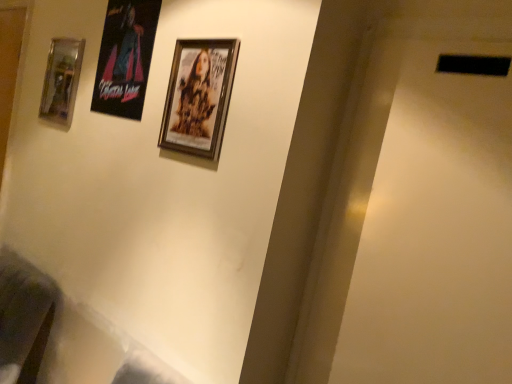
How much space does metallic glass picture frame at left, acting as the first picture frame starting from the left, occupy vertically?

metallic glass picture frame at left, acting as the first picture frame starting from the left, is 36.32 centimeters tall.

At what (x,y) coordinates should I click in order to perform the action: click on metallic glass picture frame at left, placed as the first picture frame when sorted from back to front. Please return your answer as a coordinate pair (x, y). The height and width of the screenshot is (384, 512). Looking at the image, I should click on (61, 81).

Describe the element at coordinates (61, 81) in the screenshot. This screenshot has width=512, height=384. I see `metallic glass picture frame at left, the second picture frame from the front` at that location.

You are a GUI agent. You are given a task and a screenshot of the screen. Output one action in this format:
    pyautogui.click(x=<x>, y=<y>)
    Task: Click on the wooden framed poster at center, arranged as the second picture frame when viewed from the left
    The height and width of the screenshot is (384, 512).
    Given the screenshot: What is the action you would take?
    pyautogui.click(x=199, y=96)

The height and width of the screenshot is (384, 512). Describe the element at coordinates (199, 96) in the screenshot. I see `wooden framed poster at center, arranged as the second picture frame when viewed from the left` at that location.

Identify the location of metallic glass picture frame at left, which appears as the 2th picture frame when viewed from the right. This screenshot has width=512, height=384. (61, 81).

Would you say metallic glass picture frame at left, which appears as the 2th picture frame when viewed from the right, is to the left or to the right of wooden framed poster at center, the second picture frame in the back-to-front sequence, in the picture?

metallic glass picture frame at left, which appears as the 2th picture frame when viewed from the right, is to the left of wooden framed poster at center, the second picture frame in the back-to-front sequence.

Based on the photo, in the image, is metallic glass picture frame at left, which appears as the 2th picture frame when viewed from the right, positioned in front of or behind wooden framed poster at center, the second picture frame in the back-to-front sequence?

metallic glass picture frame at left, which appears as the 2th picture frame when viewed from the right, is behind wooden framed poster at center, the second picture frame in the back-to-front sequence.

Is point (75, 88) in front of point (164, 111)?

No, (75, 88) is further to viewer.

From the image's perspective, would you say metallic glass picture frame at left, the second picture frame from the front, is shown under wooden framed poster at center, which ranks as the first picture frame in front-to-back order?

Incorrect, from the image's perspective, metallic glass picture frame at left, the second picture frame from the front, is higher than wooden framed poster at center, which ranks as the first picture frame in front-to-back order.

From a real-world perspective, relative to wooden framed poster at center, the second picture frame in the back-to-front sequence, is metallic glass picture frame at left, the second picture frame from the front, vertically above or below?

In terms of real-world spatial position, metallic glass picture frame at left, the second picture frame from the front, is above wooden framed poster at center, the second picture frame in the back-to-front sequence.

In the scene shown: Between metallic glass picture frame at left, the second picture frame from the front, and wooden framed poster at center, arranged as the second picture frame when viewed from the left, which one has smaller width?

With smaller width is wooden framed poster at center, arranged as the second picture frame when viewed from the left.

Does metallic glass picture frame at left, the second picture frame from the front, have a lesser height compared to wooden framed poster at center, the 1th picture frame viewed from the right?

Indeed, metallic glass picture frame at left, the second picture frame from the front, has a lesser height compared to wooden framed poster at center, the 1th picture frame viewed from the right.

Considering the relative sizes of metallic glass picture frame at left, which appears as the 2th picture frame when viewed from the right, and wooden framed poster at center, the second picture frame in the back-to-front sequence, in the image provided, is metallic glass picture frame at left, which appears as the 2th picture frame when viewed from the right, bigger than wooden framed poster at center, the second picture frame in the back-to-front sequence,?

Yes, metallic glass picture frame at left, which appears as the 2th picture frame when viewed from the right, is bigger than wooden framed poster at center, the second picture frame in the back-to-front sequence.

Would you say metallic glass picture frame at left, the second picture frame from the front, is inside or outside wooden framed poster at center, which ranks as the first picture frame in front-to-back order?

metallic glass picture frame at left, the second picture frame from the front, is outside wooden framed poster at center, which ranks as the first picture frame in front-to-back order.

Is metallic glass picture frame at left, which appears as the 2th picture frame when viewed from the right, in contact with wooden framed poster at center, the second picture frame in the back-to-front sequence?

No, metallic glass picture frame at left, which appears as the 2th picture frame when viewed from the right, is not beside wooden framed poster at center, the second picture frame in the back-to-front sequence.

Is metallic glass picture frame at left, placed as the first picture frame when sorted from back to front, oriented away from wooden framed poster at center, which ranks as the first picture frame in front-to-back order?

No, metallic glass picture frame at left, placed as the first picture frame when sorted from back to front, is not facing away from wooden framed poster at center, which ranks as the first picture frame in front-to-back order.

How many degrees apart are the facing directions of metallic glass picture frame at left, which appears as the 2th picture frame when viewed from the right, and wooden framed poster at center, arranged as the second picture frame when viewed from the left?

There is a 0.00917-degree angle between the facing directions of metallic glass picture frame at left, which appears as the 2th picture frame when viewed from the right, and wooden framed poster at center, arranged as the second picture frame when viewed from the left.

Measure the distance between metallic glass picture frame at left, which appears as the 2th picture frame when viewed from the right, and wooden framed poster at center, the 1th picture frame viewed from the right.

metallic glass picture frame at left, which appears as the 2th picture frame when viewed from the right, is 27.55 inches away from wooden framed poster at center, the 1th picture frame viewed from the right.

The image size is (512, 384). I want to click on picture frame lying on the left of wooden framed poster at center, which ranks as the first picture frame in front-to-back order, so click(x=61, y=81).

Would you say wooden framed poster at center, the 1th picture frame viewed from the right, is to the left or to the right of metallic glass picture frame at left, placed as the first picture frame when sorted from back to front, in the picture?

From the image, it's evident that wooden framed poster at center, the 1th picture frame viewed from the right, is to the right of metallic glass picture frame at left, placed as the first picture frame when sorted from back to front.

Consider the image. Is wooden framed poster at center, the second picture frame in the back-to-front sequence, further to camera compared to metallic glass picture frame at left, which appears as the 2th picture frame when viewed from the right?

No, wooden framed poster at center, the second picture frame in the back-to-front sequence, is closer to the camera.

Which is farther from the camera, [165,113] or [45,113]?

Point [45,113]

From the image's perspective, would you say wooden framed poster at center, which ranks as the first picture frame in front-to-back order, is shown under metallic glass picture frame at left, the second picture frame from the front?

Indeed, from the image's perspective, wooden framed poster at center, which ranks as the first picture frame in front-to-back order, is shown beneath metallic glass picture frame at left, the second picture frame from the front.

From a real-world perspective, is wooden framed poster at center, the 1th picture frame viewed from the right, positioned above or below metallic glass picture frame at left, placed as the first picture frame when sorted from back to front?

wooden framed poster at center, the 1th picture frame viewed from the right, is situated lower than metallic glass picture frame at left, placed as the first picture frame when sorted from back to front, in the real world.

From the picture: Which object is wider, wooden framed poster at center, the second picture frame in the back-to-front sequence, or metallic glass picture frame at left, acting as the first picture frame starting from the left?

metallic glass picture frame at left, acting as the first picture frame starting from the left.

Is wooden framed poster at center, the second picture frame in the back-to-front sequence, shorter than metallic glass picture frame at left, the second picture frame from the front?

Incorrect, the height of wooden framed poster at center, the second picture frame in the back-to-front sequence, does not fall short of that of metallic glass picture frame at left, the second picture frame from the front.

Does wooden framed poster at center, the second picture frame in the back-to-front sequence, have a smaller size compared to metallic glass picture frame at left, acting as the first picture frame starting from the left?

Correct, wooden framed poster at center, the second picture frame in the back-to-front sequence, occupies less space than metallic glass picture frame at left, acting as the first picture frame starting from the left.

Is wooden framed poster at center, the 1th picture frame viewed from the right, outside of metallic glass picture frame at left, acting as the first picture frame starting from the left?

Absolutely, wooden framed poster at center, the 1th picture frame viewed from the right, is external to metallic glass picture frame at left, acting as the first picture frame starting from the left.

Is wooden framed poster at center, arranged as the second picture frame when viewed from the left, beside metallic glass picture frame at left, placed as the first picture frame when sorted from back to front?

No, wooden framed poster at center, arranged as the second picture frame when viewed from the left, is not beside metallic glass picture frame at left, placed as the first picture frame when sorted from back to front.

Is wooden framed poster at center, arranged as the second picture frame when viewed from the left, facing away from metallic glass picture frame at left, which appears as the 2th picture frame when viewed from the right?

No.

Can you tell me how much wooden framed poster at center, which ranks as the first picture frame in front-to-back order, and metallic glass picture frame at left, which appears as the 2th picture frame when viewed from the right, differ in facing direction?

The angle between the facing direction of wooden framed poster at center, which ranks as the first picture frame in front-to-back order, and the facing direction of metallic glass picture frame at left, which appears as the 2th picture frame when viewed from the right, is 0.00917 degrees.

Image resolution: width=512 pixels, height=384 pixels. I want to click on picture frame above the wooden framed poster at center, arranged as the second picture frame when viewed from the left (from a real-world perspective), so click(x=61, y=81).

This screenshot has width=512, height=384. What are the coordinates of `picture frame that appears below the metallic glass picture frame at left, acting as the first picture frame starting from the left (from the image's perspective)` in the screenshot? It's located at (199, 96).

Identify the location of picture frame that appears below the metallic glass picture frame at left, the second picture frame from the front (from a real-world perspective). The width and height of the screenshot is (512, 384). (199, 96).